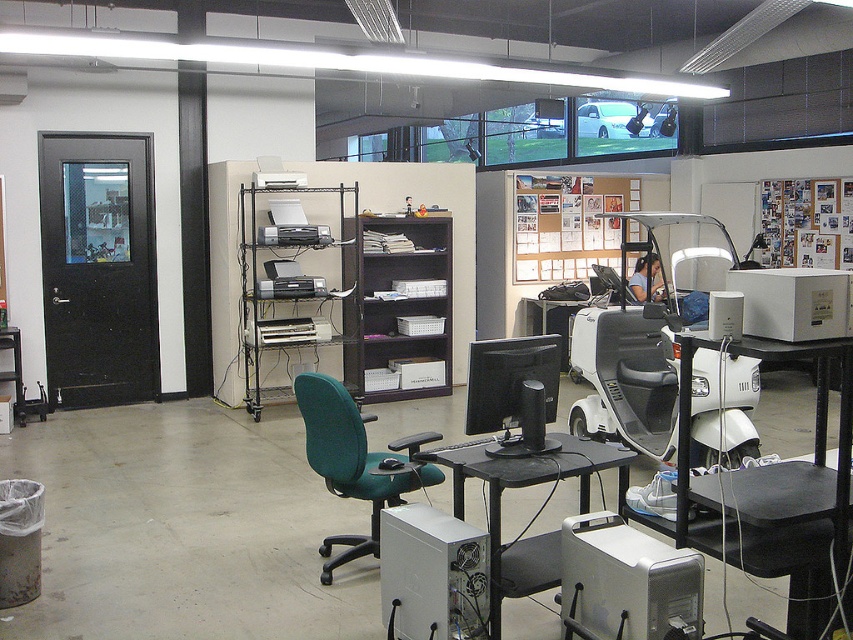
Question: Which object is farther from the camera taking this photo?

Choices:
 (A) white plastic desktop computer at center
 (B) black plastic computer desk at center
 (C) teal fabric swivel chair at center

Answer: (C)

Question: Observing the image, what is the correct spatial positioning of black plastic computer desk at center in reference to white plastic desktop computer at center?

Choices:
 (A) above
 (B) below

Answer: (A)

Question: Which object is positioned closest to the black glossy monitor at center?

Choices:
 (A) black plastic table at center
 (B) teal fabric swivel chair at center
 (C) satin silver desktop at lower center

Answer: (A)

Question: Which point is farther to the camera?

Choices:
 (A) black plastic computer desk at center
 (B) white plastic desktop computer at center

Answer: (B)

Question: Can you confirm if satin silver desktop at lower center is bigger than black plastic table at center?

Choices:
 (A) yes
 (B) no

Answer: (B)

Question: Does black plastic computer desk at center appear over black plastic table at center?

Choices:
 (A) yes
 (B) no

Answer: (A)